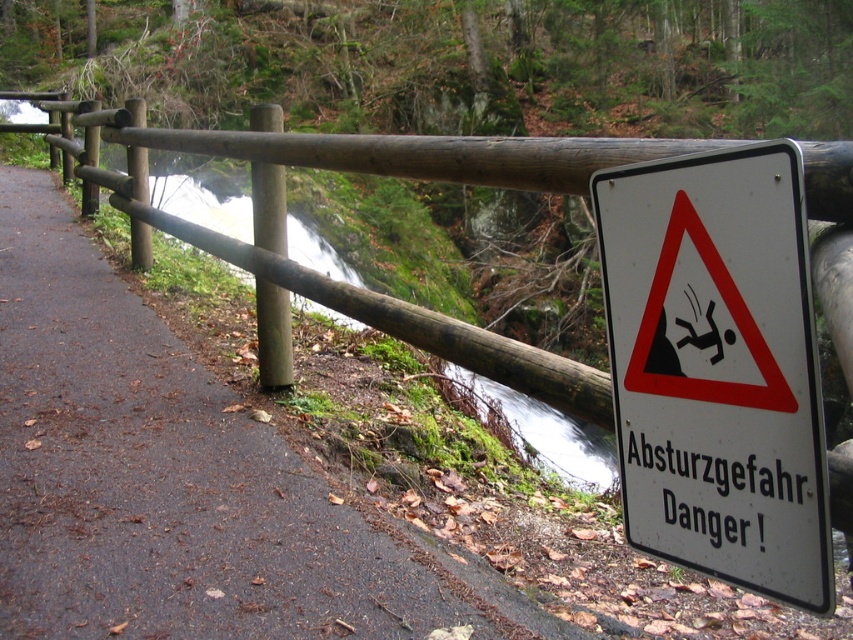
You are standing on the pathway and want to read the text on the white plastic sign at right. Can you reach it without moving closer than 30 inches?

The white plastic sign at right is 30.36 inches away from the viewer, so you can reach it without moving closer than 30 inches since it is slightly farther than 30 inches.

You are a hiker who wants to take a photo of both the white plastic sign at right and the green mossy creek at left. Since you can only focus on one object at a time, which one should you adjust your camera focus to first to ensure it appears sharp in the photo?

You should focus on the white plastic sign at right first because it is closer to you than the green mossy creek at left, so adjusting focus on the closer object ensures it will be sharp.

You are standing on the paved pathway and looking towards the waterfall. Where is the white plastic sign at right located in relation to the wooden railing?

The white plastic sign at right is attached to the wooden railing in the foreground.